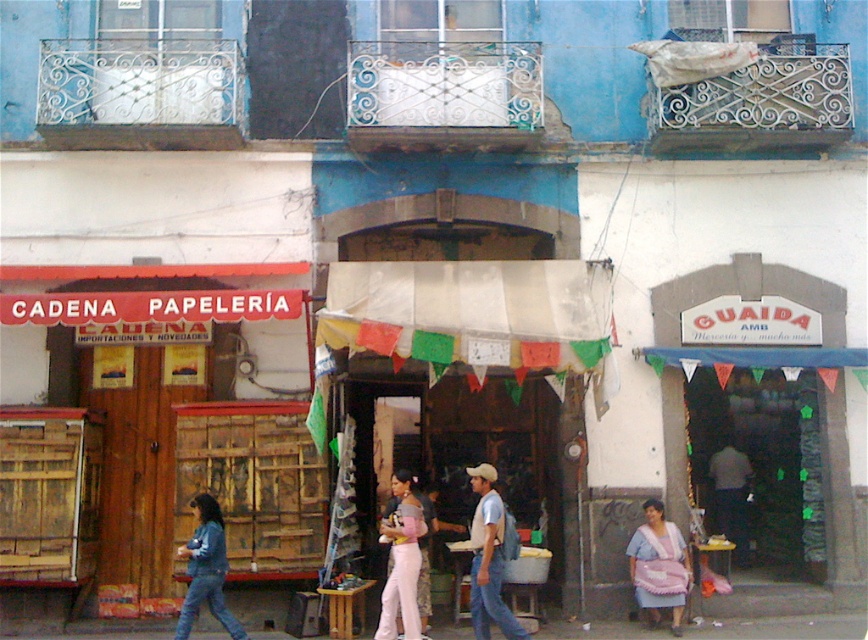
You are a customer in the store and want to reach the light blue denim jeans at center and the pink fabric at lower right. Which item is taller and requires you to stand on your tiptoes to reach?

The light blue denim jeans at center is much taller than the pink fabric at lower right, so you would need to stand on your tiptoes to reach the light blue denim jeans at center.

You are a customer in a clothing store and see two items displayed on a rack in the middle of the store. The items are light blue denim jeans at center and light pink fabric at center. Which item is closer to you?

The light blue denim jeans at center is closer to you because it is in front of the light pink fabric at center.

You are a customer looking to purchase a pair of jeans and a fabric for a craft project. You see the light blue denim jeans at center and the light pink fabric at center in a store. Which item takes up more space on the shelf?

The light blue denim jeans at center is larger in size than the light pink fabric at center, so the light blue denim jeans at center takes up more space on the shelf.